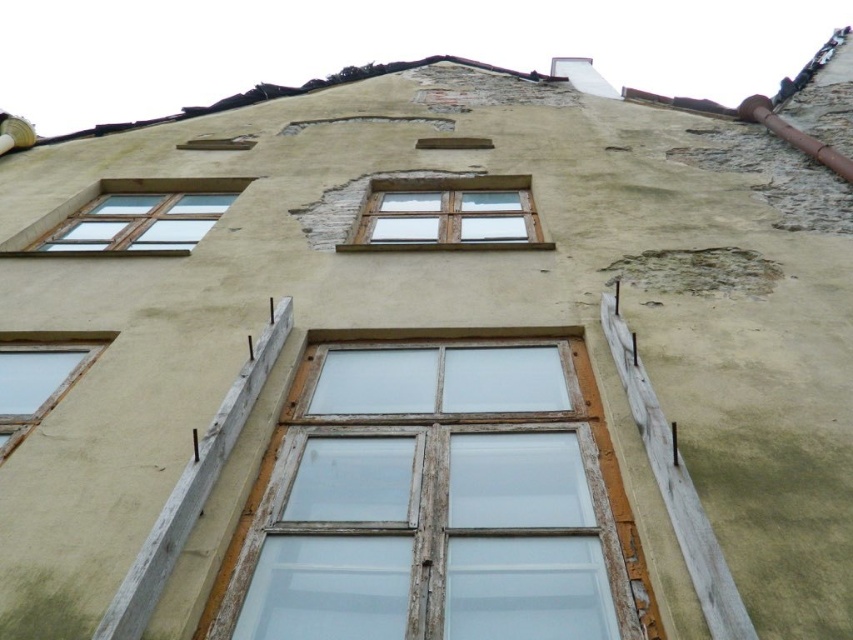
Does clear glass window at upper left appear on the left side of transparent glass window at lower left?

Correct, you'll find clear glass window at upper left to the left of transparent glass window at lower left.

Is clear glass window at upper left above transparent glass window at lower left?

Yes, clear glass window at upper left is above transparent glass window at lower left.

Is point (47, 253) closer to camera compared to point (24, 397)?

No, it is not.

Identify the location of clear glass window at upper left. The image size is (853, 640). (129, 218).

Who is lower down, weathered wood window at center or clear glass window at upper left?

weathered wood window at center is lower down.

In the scene shown: Can you confirm if weathered wood window at center is shorter than clear glass window at upper left?

Incorrect, weathered wood window at center's height does not fall short of clear glass window at upper left's.

The width and height of the screenshot is (853, 640). Describe the element at coordinates (436, 502) in the screenshot. I see `weathered wood window at center` at that location.

The width and height of the screenshot is (853, 640). I want to click on weathered wood window at center, so click(x=436, y=502).

Can you confirm if weathered wood window at center is thinner than transparent glass window at lower left?

In fact, weathered wood window at center might be wider than transparent glass window at lower left.

Does point (541, 483) lie in front of point (22, 376)?

Yes, it is.

In order to click on weathered wood window at center in this screenshot , I will do `click(436, 502)`.